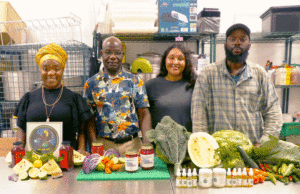
The height and width of the screenshot is (194, 300). I want to click on jars, so click(146, 159), click(135, 165), click(100, 150).